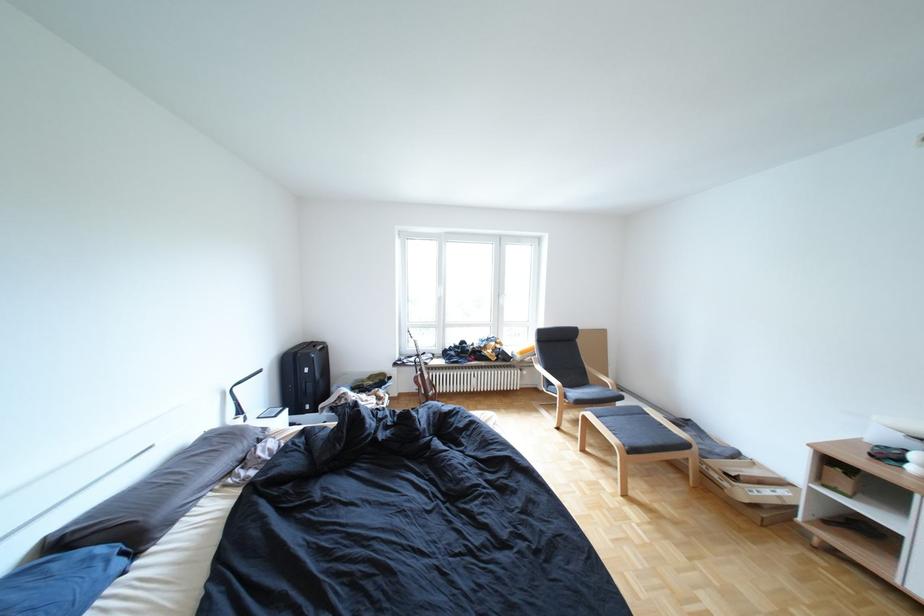
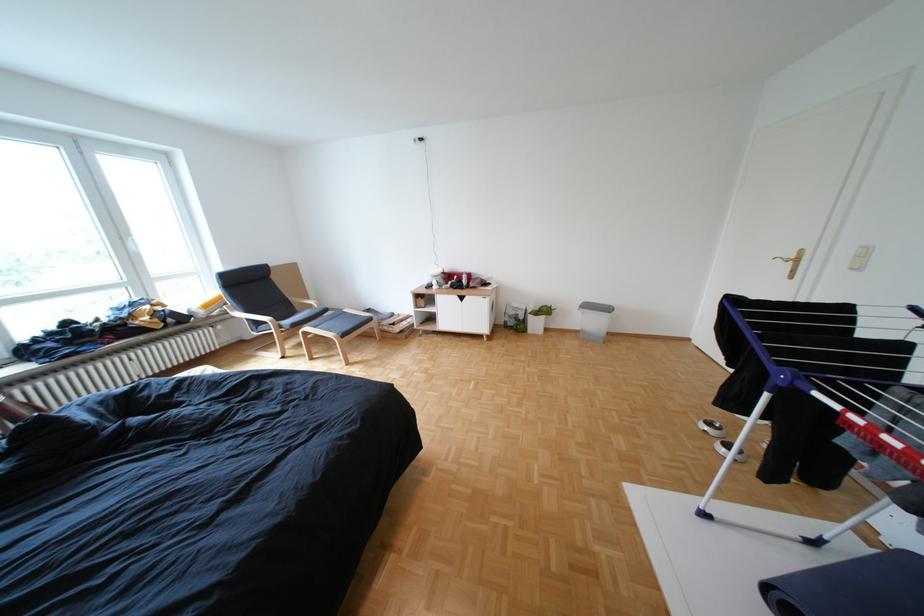
Find the pixel in the second image that matches point 700,446 in the first image.

(386, 320)